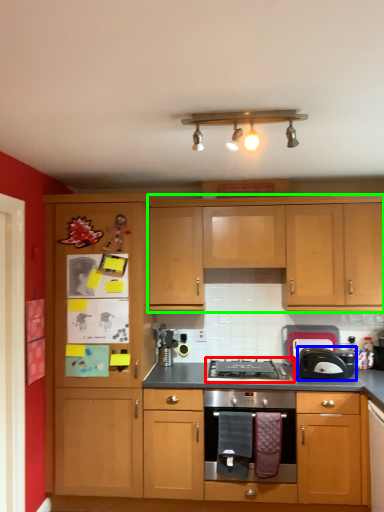
Question: Estimate the real-world distances between objects in this image. Which object is farther from gas stove (highlighted by a red box), toaster (highlighted by a blue box) or cabinetry (highlighted by a green box)?

Choices:
 (A) toaster
 (B) cabinetry

Answer: (B)